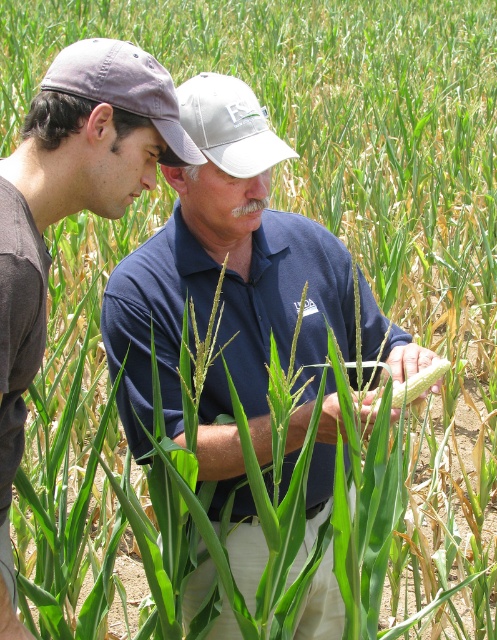
Does matte blue shirt at center have a lesser height compared to white fabric baseball cap at center?

Incorrect, matte blue shirt at center's height does not fall short of white fabric baseball cap at center's.

Where is `matte blue shirt at center`? matte blue shirt at center is located at coordinates (70, 209).

Which is in front, point (174, 150) or point (205, 83)?

Point (174, 150) is in front.

What are the coordinates of `matte gray baseball cap at left` in the screenshot? It's located at (125, 88).

What do you see at coordinates (125, 88) in the screenshot?
I see `matte gray baseball cap at left` at bounding box center [125, 88].

Image resolution: width=497 pixels, height=640 pixels. I want to click on matte gray baseball cap at left, so click(x=125, y=88).

Does matte gray baseball cap at left have a lesser width compared to yellow matte corn at center?

No, matte gray baseball cap at left is not thinner than yellow matte corn at center.

Is point (149, 58) in front of point (400, 401)?

Yes, point (149, 58) is in front of point (400, 401).

I want to click on matte gray baseball cap at left, so click(125, 88).